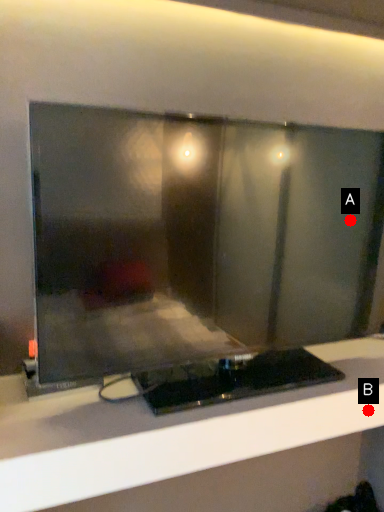
Question: Two points are circled on the image, labeled by A and B beside each circle. Which point is closer to the camera?

Choices:
 (A) A is closer
 (B) B is closer

Answer: (B)